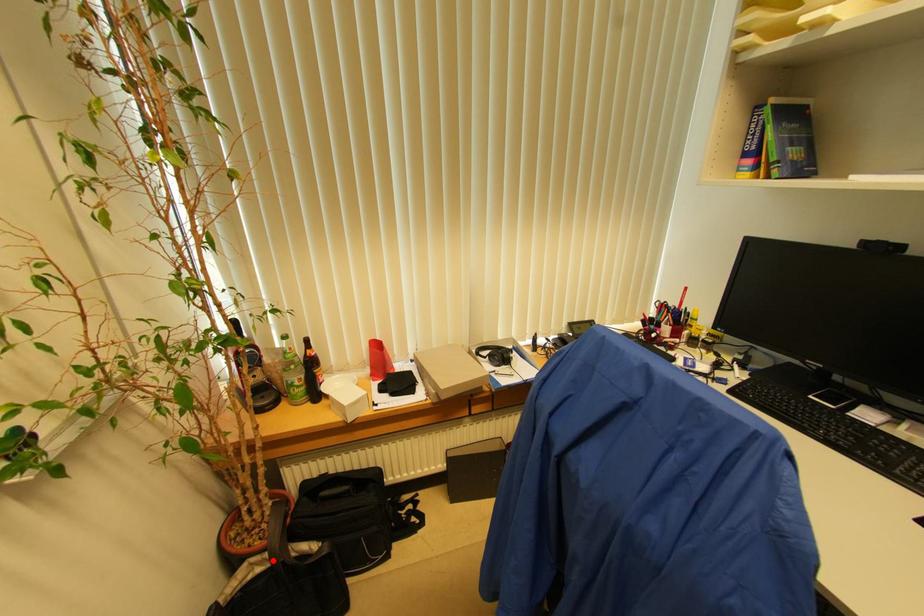
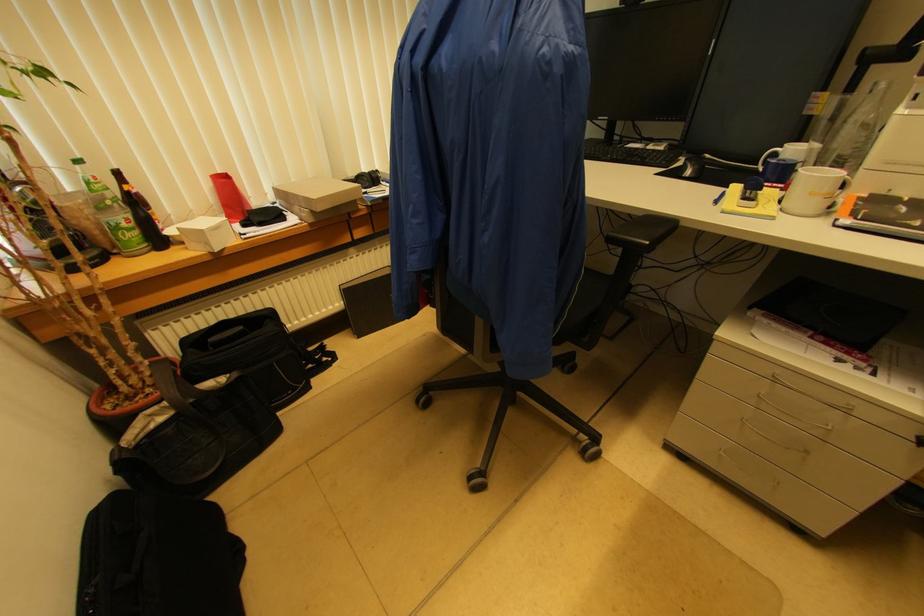
The point at the highlighted location is marked in the first image. Where is the corresponding point in the second image?

(175, 408)